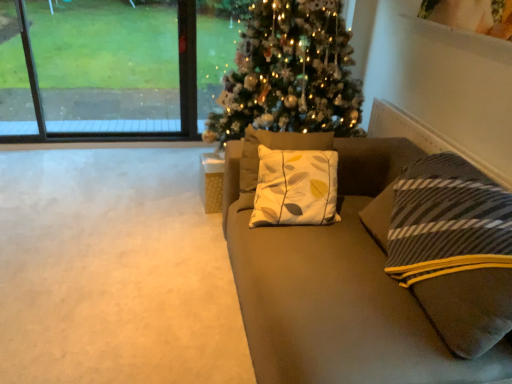
The image size is (512, 384). In order to click on vacant area that is in front of wooden cube at center in this screenshot , I will do tap(198, 218).